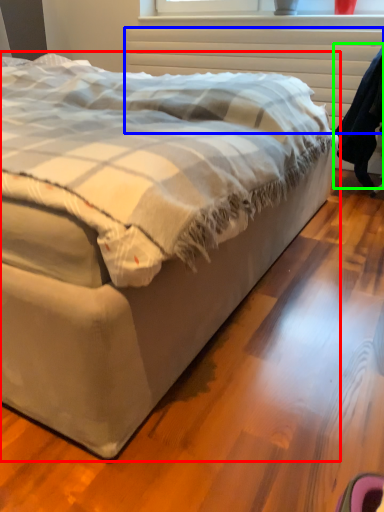
Question: Which object is positioned farthest from bed (highlighted by a red box)? Select from radiator (highlighted by a blue box) and robe (highlighted by a green box).

Choices:
 (A) radiator
 (B) robe

Answer: (A)